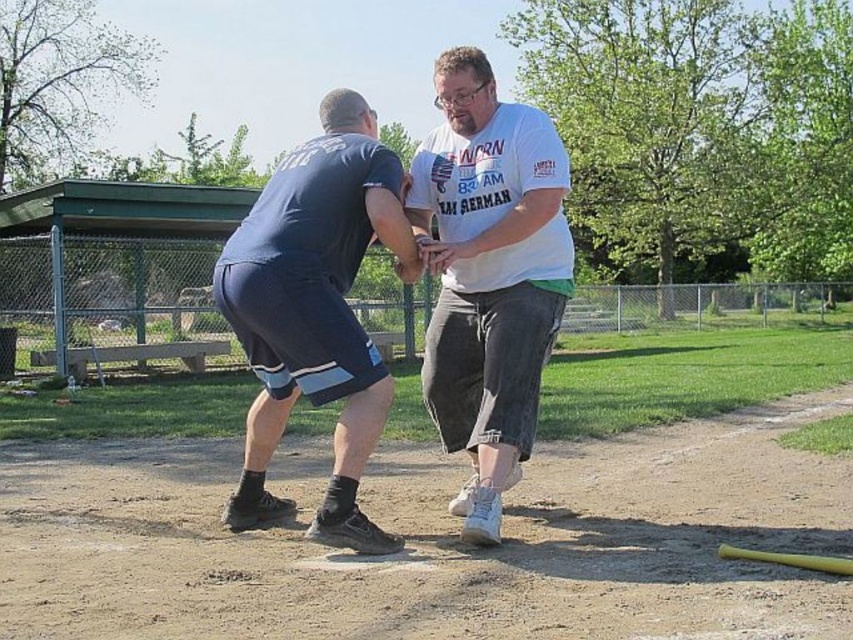
Question: From the image, what is the correct spatial relationship of white cotton shirt at center in relation to dark blue shorts at left?

Choices:
 (A) left
 (B) right

Answer: (B)

Question: Can you confirm if white cotton shirt at center is positioned above yellow matte baseball bat at lower right?

Choices:
 (A) yes
 (B) no

Answer: (A)

Question: Estimate the real-world distances between objects in this image. Which object is closer to the white cotton shirt at center?

Choices:
 (A) yellow matte baseball bat at lower right
 (B) dark blue shorts at left

Answer: (B)

Question: Is white cotton shirt at center smaller than yellow matte baseball bat at lower right?

Choices:
 (A) no
 (B) yes

Answer: (A)

Question: Which point is farther from the camera taking this photo?

Choices:
 (A) (350, 209)
 (B) (813, 563)

Answer: (A)

Question: Estimate the real-world distances between objects in this image. Which object is closer to the white cotton shirt at center?

Choices:
 (A) yellow matte baseball bat at lower right
 (B) dark blue shorts at left

Answer: (B)